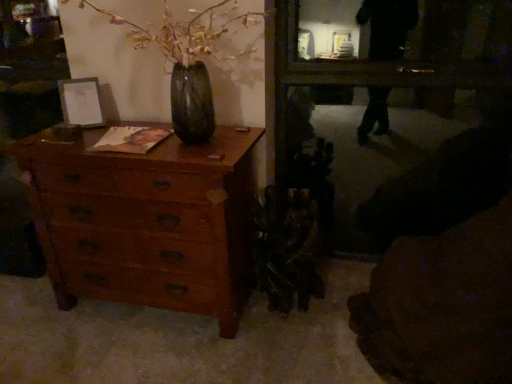
The width and height of the screenshot is (512, 384). Describe the element at coordinates (145, 220) in the screenshot. I see `wooden chest of drawers at left` at that location.

You are a GUI agent. You are given a task and a screenshot of the screen. Output one action in this format:
    pyautogui.click(x=<x>, y=<y>)
    Task: Click on the wooden chest of drawers at left
    This screenshot has width=512, height=384.
    Given the screenshot: What is the action you would take?
    pyautogui.click(x=145, y=220)

At what (x,y) coordinates should I click in order to perform the action: click on wooden chest of drawers at left. Please return your answer as a coordinate pair (x, y). Looking at the image, I should click on (145, 220).